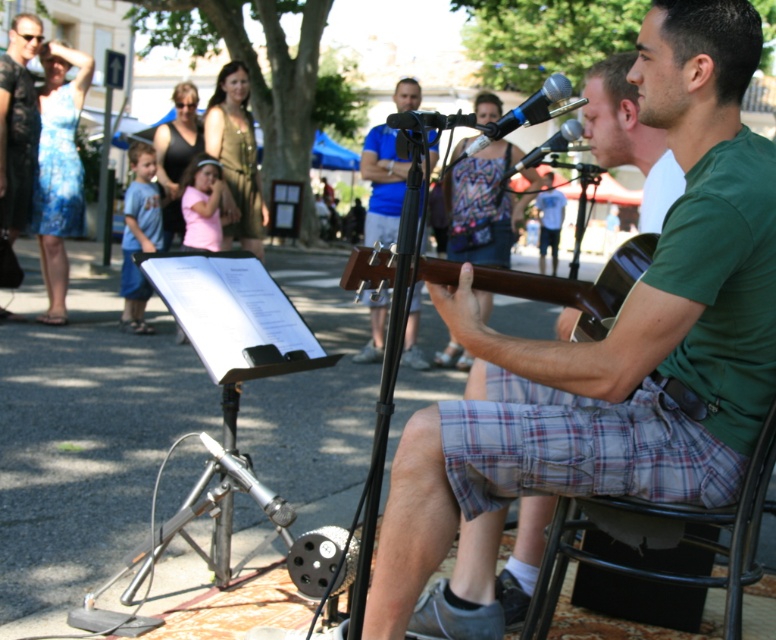
Question: Considering the relative positions of blue fabric guitar at center and blue metallic microphone at center in the image provided, where is blue fabric guitar at center located with respect to blue metallic microphone at center?

Choices:
 (A) above
 (B) below

Answer: (A)

Question: Which object is the farthest from the black matte microphone at center?

Choices:
 (A) blue metallic microphone at center
 (B) brown wood guitar at center
 (C) black lace dress at left
 (D) wooden acoustic guitar at center

Answer: (C)

Question: Considering the real-world distances, which object is farthest from the black matte microphone at center?

Choices:
 (A) brown wood guitar at center
 (B) black lace dress at left
 (C) blue fabric guitar at center
 (D) wooden acoustic guitar at center

Answer: (B)

Question: Among these objects, which one is nearest to the camera?

Choices:
 (A) wooden acoustic guitar at center
 (B) blue fabric guitar at center
 (C) black matte microphone at center

Answer: (A)

Question: Does wooden acoustic guitar at center have a lesser width compared to black lace dress at left?

Choices:
 (A) no
 (B) yes

Answer: (A)

Question: From the image, what is the correct spatial relationship of black lace dress at left in relation to black matte microphone at center?

Choices:
 (A) below
 (B) above

Answer: (B)